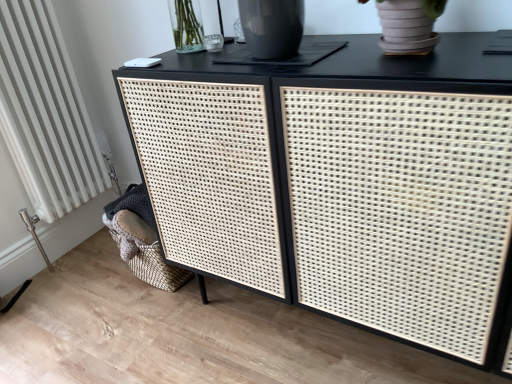
Question: Is black woven cabinet at center taller or shorter than white textured radiator at lower left?

Choices:
 (A) short
 (B) tall

Answer: (A)

Question: Is black woven cabinet at center inside the boundaries of white textured radiator at lower left, or outside?

Choices:
 (A) outside
 (B) inside

Answer: (A)

Question: In terms of width, does black woven cabinet at center look wider or thinner when compared to white textured radiator at lower left?

Choices:
 (A) wide
 (B) thin

Answer: (A)

Question: Considering the positions of point (56, 100) and point (174, 110), is point (56, 100) closer or farther from the camera than point (174, 110)?

Choices:
 (A) farther
 (B) closer

Answer: (A)

Question: In terms of height, does white textured radiator at lower left look taller or shorter compared to black woven cabinet at center?

Choices:
 (A) tall
 (B) short

Answer: (A)

Question: Is white textured radiator at lower left to the left or to the right of black woven cabinet at center in the image?

Choices:
 (A) left
 (B) right

Answer: (A)

Question: From the image's perspective, is white textured radiator at lower left located above or below black woven cabinet at center?

Choices:
 (A) below
 (B) above

Answer: (B)